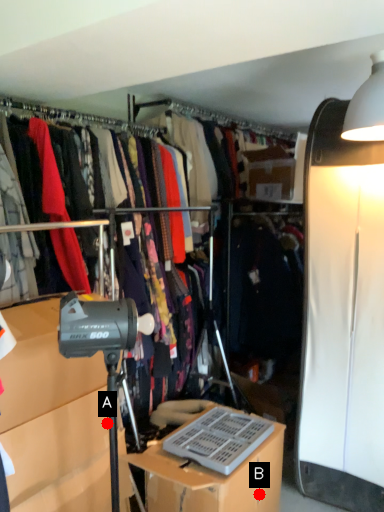
Question: Two points are circled on the image, labeled by A and B beside each circle. Which of the following is the closest to the observer?

Choices:
 (A) A is closer
 (B) B is closer

Answer: (A)